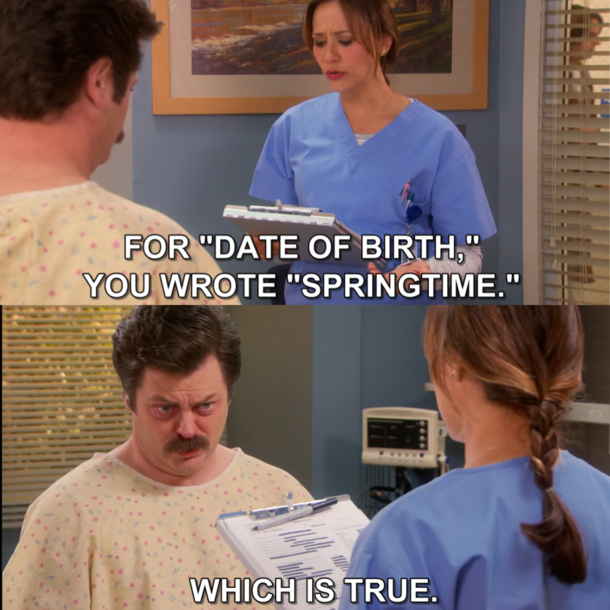
This screenshot has width=610, height=610. What are the coordinates of `sharpie marker` in the screenshot? It's located at (298, 512).